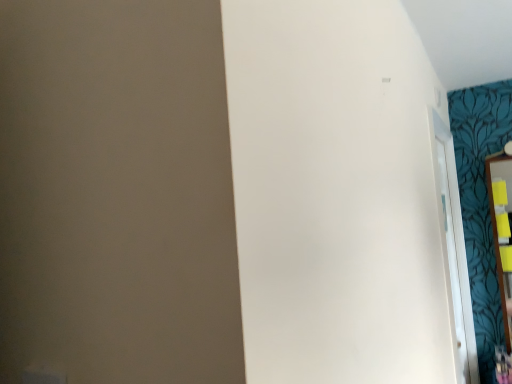
Describe the element at coordinates (454, 251) in the screenshot. I see `white glossy door at right` at that location.

Identify the location of white glossy door at right. Image resolution: width=512 pixels, height=384 pixels. (454, 251).

Locate an element on the screen. white glossy door at right is located at coordinates (454, 251).